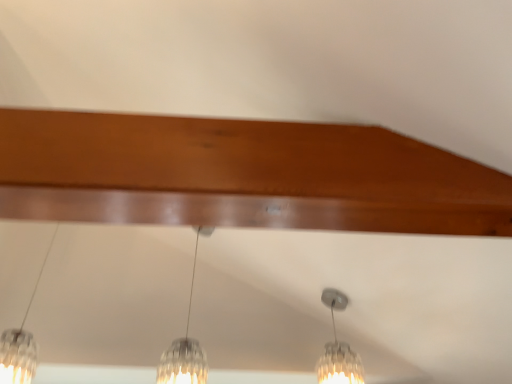
Question: Does clear glass pendant light at left, placed as the 3th lamp when sorted from right to left, appear on the right side of clear glass pendant light at center, the third lamp from the left?

Choices:
 (A) no
 (B) yes

Answer: (A)

Question: Considering the relative sizes of clear glass pendant light at left, the first lamp when ordered from left to right, and clear glass pendant light at center, positioned as the first lamp in right-to-left order, in the image provided, is clear glass pendant light at left, the first lamp when ordered from left to right, shorter than clear glass pendant light at center, positioned as the first lamp in right-to-left order,?

Choices:
 (A) yes
 (B) no

Answer: (B)

Question: Is clear glass pendant light at left, the first lamp when ordered from left to right, not close to clear glass pendant light at center, the third lamp from the left?

Choices:
 (A) no
 (B) yes

Answer: (B)

Question: From a real-world perspective, is clear glass pendant light at left, placed as the 3th lamp when sorted from right to left, positioned over clear glass pendant light at center, the third lamp from the left, based on gravity?

Choices:
 (A) yes
 (B) no

Answer: (A)

Question: Is clear glass pendant light at left, the first lamp when ordered from left to right, closer to camera compared to clear glass pendant light at center, the third lamp from the left?

Choices:
 (A) no
 (B) yes

Answer: (B)

Question: Do you think clear glass pendant light at left, the first lamp when ordered from left to right, is within clear glass pendant light at center, positioned as the first lamp in right-to-left order, or outside of it?

Choices:
 (A) inside
 (B) outside

Answer: (B)

Question: In terms of height, does clear glass pendant light at left, placed as the 3th lamp when sorted from right to left, look taller or shorter compared to clear glass pendant light at center, the third lamp from the left?

Choices:
 (A) tall
 (B) short

Answer: (A)

Question: Is clear glass pendant light at left, the first lamp when ordered from left to right, in front of or behind clear glass pendant light at center, the third lamp from the left, in the image?

Choices:
 (A) front
 (B) behind

Answer: (A)

Question: From a real-world perspective, relative to clear glass pendant light at center, positioned as the first lamp in right-to-left order, is clear glass pendant light at left, the first lamp when ordered from left to right, vertically above or below?

Choices:
 (A) below
 (B) above

Answer: (B)

Question: In terms of width, does clear glass pendant light at center, which appears as the second lamp when viewed from the left, look wider or thinner when compared to clear glass pendant light at center, the third lamp from the left?

Choices:
 (A) thin
 (B) wide

Answer: (A)

Question: Is point (186, 332) closer or farther from the camera than point (332, 332)?

Choices:
 (A) farther
 (B) closer

Answer: (B)

Question: From the image's perspective, is clear glass pendant light at center, which appears as the second lamp when viewed from the left, positioned above or below clear glass pendant light at center, the third lamp from the left?

Choices:
 (A) below
 (B) above

Answer: (B)

Question: In terms of height, does clear glass pendant light at center, positioned as the second lamp in right-to-left order, look taller or shorter compared to clear glass pendant light at center, the third lamp from the left?

Choices:
 (A) tall
 (B) short

Answer: (A)

Question: From a real-world perspective, relative to clear glass pendant light at center, which appears as the second lamp when viewed from the left, is clear glass pendant light at center, positioned as the first lamp in right-to-left order, vertically above or below?

Choices:
 (A) below
 (B) above

Answer: (A)

Question: In terms of height, does clear glass pendant light at center, the third lamp from the left, look taller or shorter compared to clear glass pendant light at center, which appears as the second lamp when viewed from the left?

Choices:
 (A) short
 (B) tall

Answer: (A)